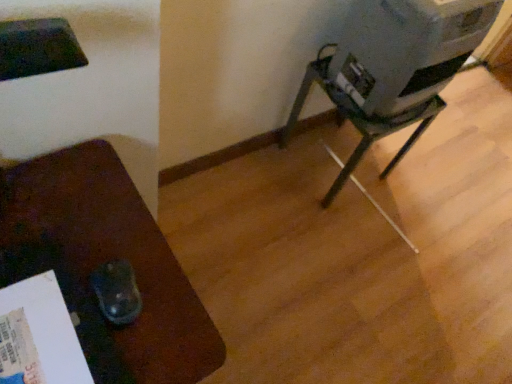
The image size is (512, 384). What are the coordinates of `free space to the left of metallic gray projector at center-right, which ranks as the first furniture in back-to-front order` in the screenshot? It's located at (262, 169).